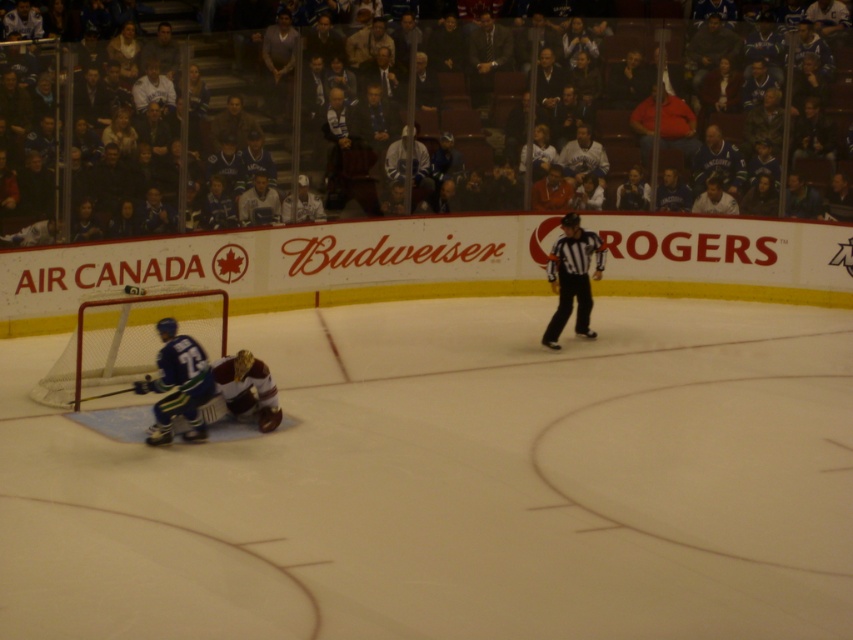
Does blue jersey at lower left have a smaller size compared to maroon jersey at center?

Incorrect, blue jersey at lower left is not smaller in size than maroon jersey at center.

Does blue jersey at lower left appear over maroon jersey at center?

Indeed, blue jersey at lower left is positioned over maroon jersey at center.

The image size is (853, 640). I want to click on blue jersey at lower left, so click(x=178, y=385).

Can you confirm if black mesh referee at center is smaller than maroon jersey at center?

No.

Between black mesh referee at center and maroon jersey at center, which one is positioned higher?

black mesh referee at center is higher up.

Does point (572, 284) lie in front of point (256, 369)?

No.

At what (x,y) coordinates should I click in order to perform the action: click on black mesh referee at center. Please return your answer as a coordinate pair (x, y). Looking at the image, I should click on (572, 276).

Does point (207, 376) come behind point (573, 328)?

That is False.

The image size is (853, 640). What do you see at coordinates (178, 385) in the screenshot? I see `blue jersey at lower left` at bounding box center [178, 385].

In order to click on blue jersey at lower left in this screenshot , I will do `click(178, 385)`.